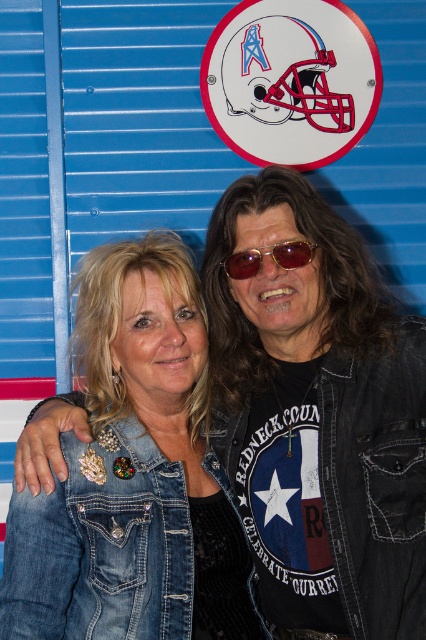
Question: Does denim jacket at center appear on the right side of denim jacket at lower right?

Choices:
 (A) yes
 (B) no

Answer: (A)

Question: Estimate the real-world distances between objects in this image. Which object is closer to the gold reflective sunglasses at center?

Choices:
 (A) denim jacket at center
 (B) denim jacket at lower right

Answer: (A)

Question: Is denim jacket at center further to camera compared to denim jacket at lower right?

Choices:
 (A) yes
 (B) no

Answer: (B)

Question: Estimate the real-world distances between objects in this image. Which object is closer to the denim jacket at center?

Choices:
 (A) gold reflective sunglasses at center
 (B) denim jacket at lower right

Answer: (B)

Question: Which point is farther to the camera?

Choices:
 (A) (302, 250)
 (B) (161, 525)
 (C) (331, 529)

Answer: (A)

Question: Is denim jacket at center closer to camera compared to gold reflective sunglasses at center?

Choices:
 (A) yes
 (B) no

Answer: (A)